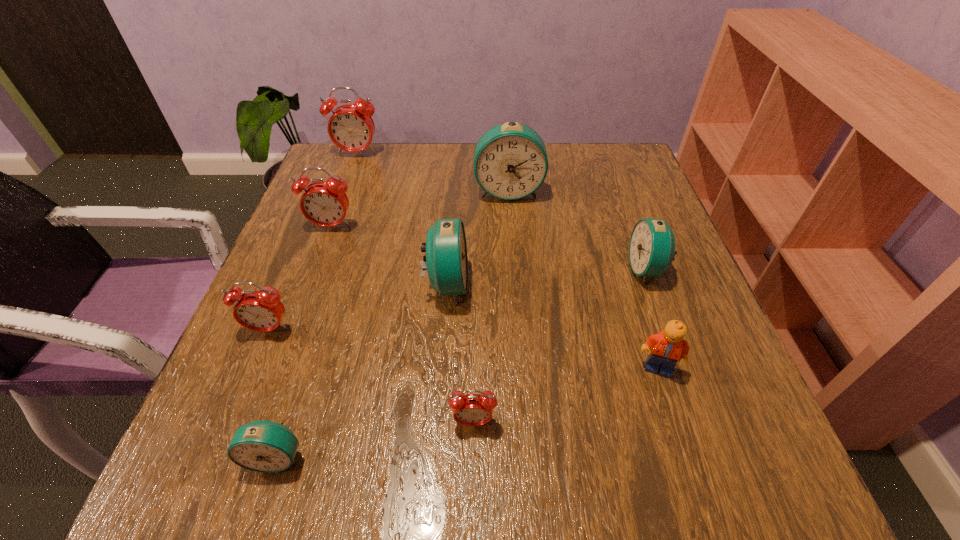
At what (x,y) coordinates should I click in order to perform the action: click on vacant area between the sixth nearest alarm clock and the third biggest red alarm clock. Please return your answer as a coordinate pair (x, y). The width and height of the screenshot is (960, 540). Looking at the image, I should click on (300, 278).

At what (x,y) coordinates should I click in order to perform the action: click on free space between the rightmost red alarm clock and the seventh nearest alarm clock. Please return your answer as a coordinate pair (x, y). The width and height of the screenshot is (960, 540). Looking at the image, I should click on (491, 307).

Where is `free space between the smallest blue alarm clock and the second blue alarm clock from left to right`? free space between the smallest blue alarm clock and the second blue alarm clock from left to right is located at coordinates (361, 370).

Locate an element on the screen. The width and height of the screenshot is (960, 540). blank region between the third nearest red alarm clock and the nearest object is located at coordinates (303, 342).

Image resolution: width=960 pixels, height=540 pixels. I want to click on vacant area between the second blue alarm clock from left to right and the smallest blue alarm clock, so click(361, 370).

Identify the location of free space between the third farthest red alarm clock and the farthest alarm clock. The width and height of the screenshot is (960, 540). (313, 242).

I want to click on empty space between the rightmost alarm clock and the second biggest red alarm clock, so click(489, 248).

At what (x,y) coordinates should I click in order to perform the action: click on vacant space that is in between the rightmost blue alarm clock and the farthest red alarm clock. Please return your answer as a coordinate pair (x, y). Looking at the image, I should click on (502, 212).

Identify which object is the seventh closest to the orange Lego. Please provide its 2D coordinates. Your answer should be formatted as a tuple, i.e. [(x, y)], where the tuple contains the x and y coordinates of a point satisfying the conditions above.

[(325, 204)]

Select which object is the sixth closest to the Lego. Please provide its 2D coordinates. Your answer should be formatted as a tuple, i.e. [(x, y)], where the tuple contains the x and y coordinates of a point satisfying the conditions above.

[(262, 311)]